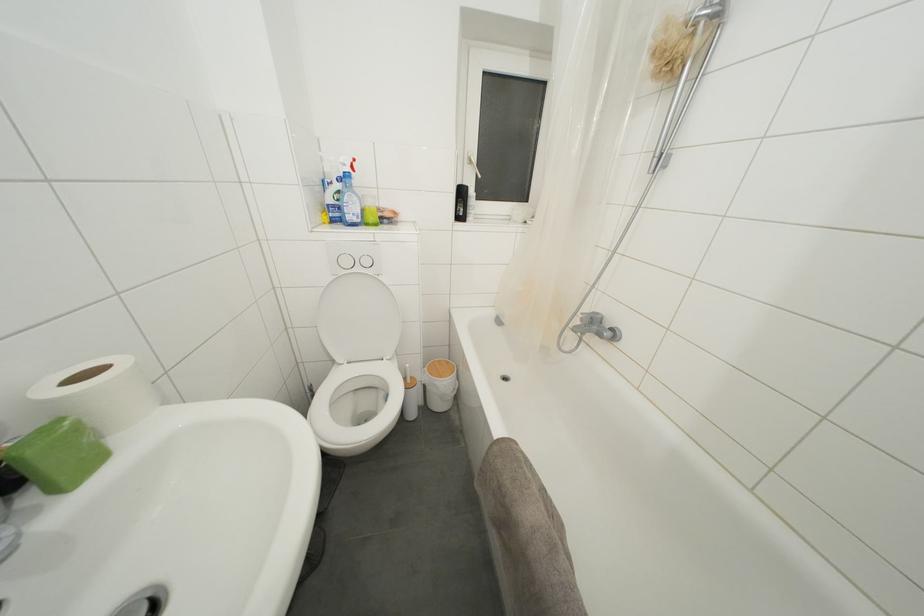
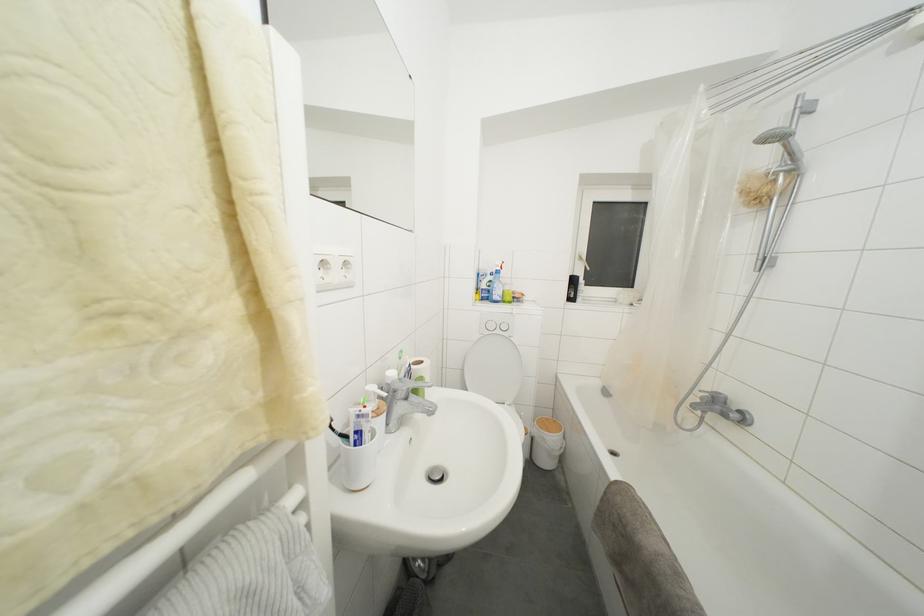
In the second image, find the point that corresponds to (586,315) in the first image.

(703, 392)